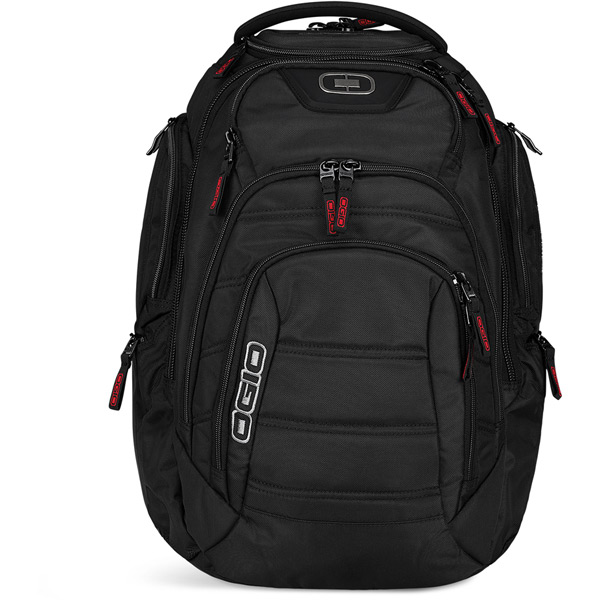
The image size is (600, 600). Identify the location of lower left  compartment. point(154,375).